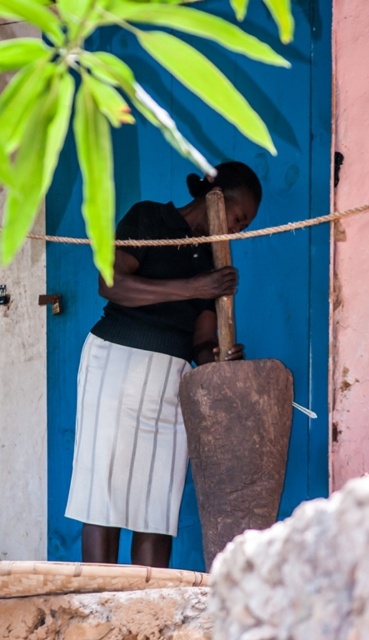
Which is above, matte black shirt at center or roperough at center?

Positioned higher is roperough at center.

Can you confirm if matte black shirt at center is wider than roperough at center?

In fact, matte black shirt at center might be narrower than roperough at center.

Where is `matte black shirt at center`? The width and height of the screenshot is (369, 640). matte black shirt at center is located at coordinates (140, 397).

Find the location of a particular element. The height and width of the screenshot is (640, 369). matte black shirt at center is located at coordinates (140, 397).

Does rusty metal shovel at center appear on the left side of roperough at center?

In fact, rusty metal shovel at center is to the right of roperough at center.

Who is positioned more to the right, rusty metal shovel at center or roperough at center?

rusty metal shovel at center is more to the right.

Measure the distance between point [183,406] and camera.

Point [183,406] is 4.44 meters away from camera.

The image size is (369, 640). I want to click on rusty metal shovel at center, so click(236, 436).

Can you confirm if matte black shirt at center is shorter than rusty metal shovel at center?

In fact, matte black shirt at center may be taller than rusty metal shovel at center.

Can you confirm if matte black shirt at center is positioned to the left of rusty metal shovel at center?

Indeed, matte black shirt at center is positioned on the left side of rusty metal shovel at center.

Who is more forward, (132, 321) or (226, 253)?

Point (226, 253) is more forward.

Where is `matte black shirt at center`? The width and height of the screenshot is (369, 640). matte black shirt at center is located at coordinates (140, 397).